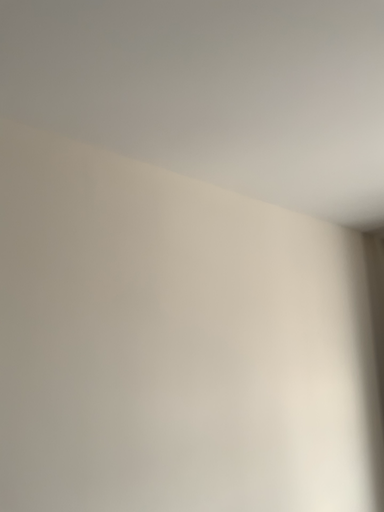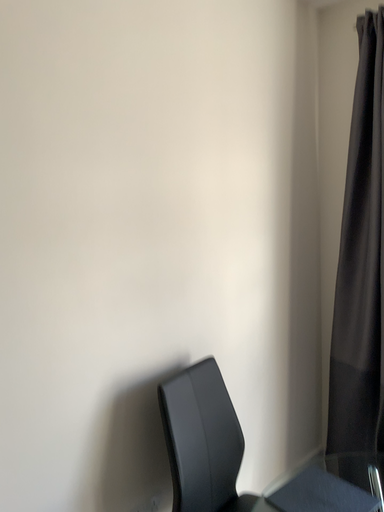
Question: Which way did the camera rotate in the video?

Choices:
 (A) rotated upward
 (B) rotated downward

Answer: (B)